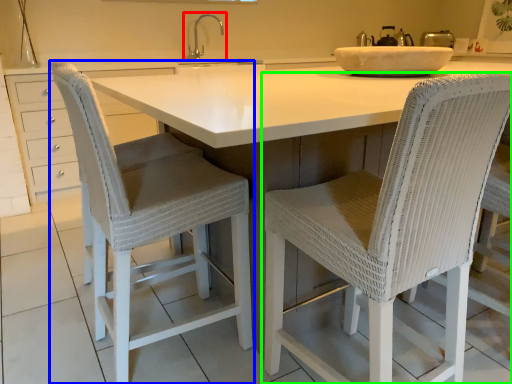
Question: Which object is the closest to the tap (highlighted by a red box)? Choose among these: chair (highlighted by a blue box) or chair (highlighted by a green box).

Choices:
 (A) chair
 (B) chair

Answer: (A)